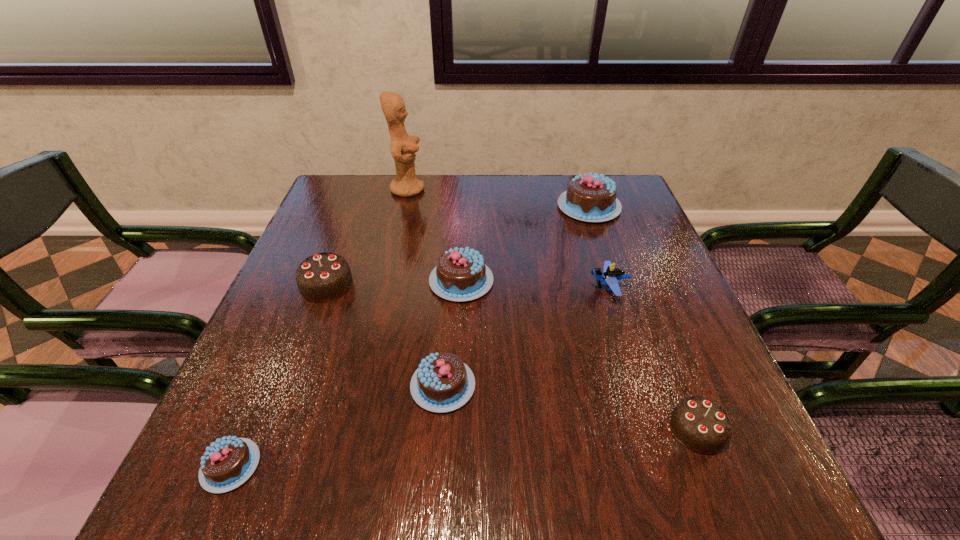
Image resolution: width=960 pixels, height=540 pixels. What are the coordinates of `free space that satisfies the following two spatial constraints: 1. on the front-facing side of the nearer chocolate chocolate cake; 2. on the right side of the figurine` in the screenshot? It's located at (351, 429).

What are the coordinates of `free space in the image that satisfies the following two spatial constraints: 1. on the front-facing side of the figurine; 2. on the front side of the left chocolate chocolate cake` in the screenshot? It's located at (386, 285).

What are the coordinates of `vacant point that satisfies the following two spatial constraints: 1. on the front-facing side of the second biggest pink chocolate cake; 2. on the left side of the third object from left to right` in the screenshot? It's located at (386, 281).

Where is `free space that satisfies the following two spatial constraints: 1. on the front-facing side of the nearer chocolate chocolate cake; 2. on the right side of the tallest object`? free space that satisfies the following two spatial constraints: 1. on the front-facing side of the nearer chocolate chocolate cake; 2. on the right side of the tallest object is located at coordinates (351, 429).

Locate an element on the screen. free point that satisfies the following two spatial constraints: 1. on the back side of the farthest pink chocolate cake; 2. on the left side of the third nearest pink chocolate cake is located at coordinates (465, 207).